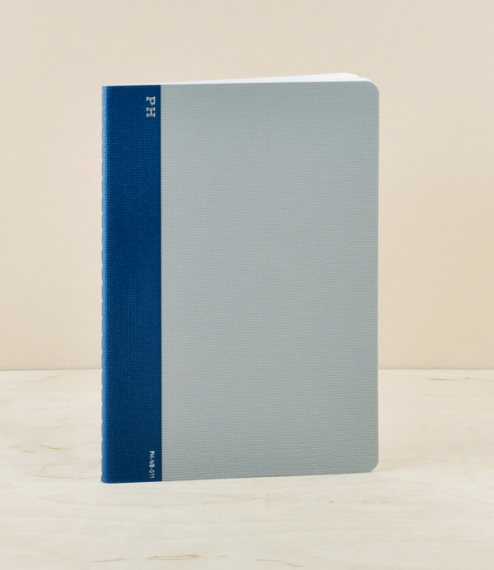
Image resolution: width=494 pixels, height=570 pixels. What are the coordinates of `spine of book` in the screenshot? It's located at (104, 367), (101, 425), (103, 197), (104, 268).